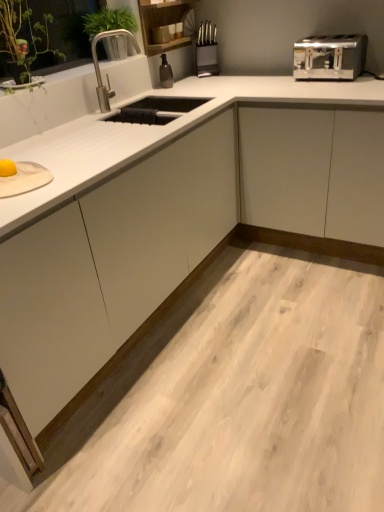
Question: Looking at their shapes, would you say green leafy plant at upper left is wider or thinner than polished stainless steel faucet at upper left?

Choices:
 (A) wide
 (B) thin

Answer: (A)

Question: Considering the relative positions of green leafy plant at upper left and polished stainless steel faucet at upper left in the image provided, is green leafy plant at upper left to the left or to the right of polished stainless steel faucet at upper left?

Choices:
 (A) right
 (B) left

Answer: (B)

Question: Considering the real-world distances, which object is closest to the polished stainless steel faucet at upper left?

Choices:
 (A) green leafy plant at upper left
 (B) satin silver toaster at upper right

Answer: (A)

Question: Which object is positioned farthest from the satin silver toaster at upper right?

Choices:
 (A) green leafy plant at upper left
 (B) polished stainless steel faucet at upper left

Answer: (A)